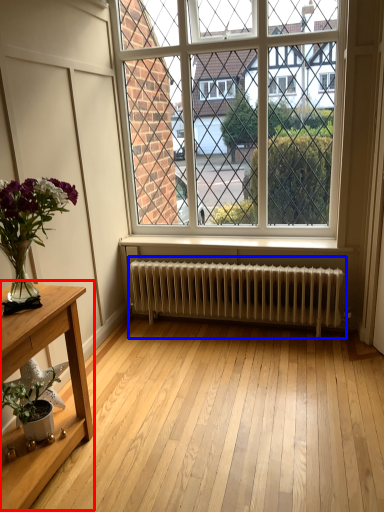
Question: Which object is further to the camera taking this photo, table (highlighted by a red box) or radiator (highlighted by a blue box)?

Choices:
 (A) table
 (B) radiator

Answer: (B)